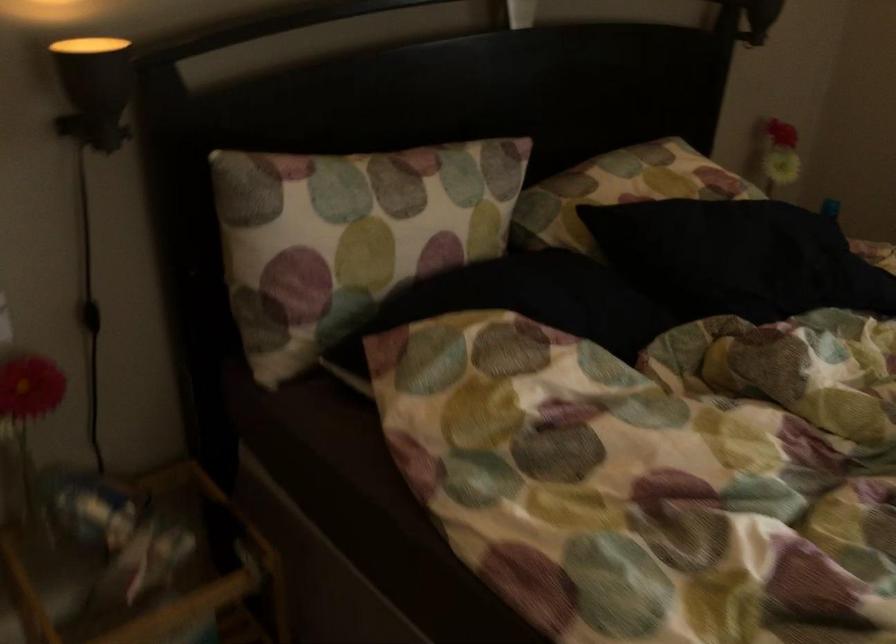
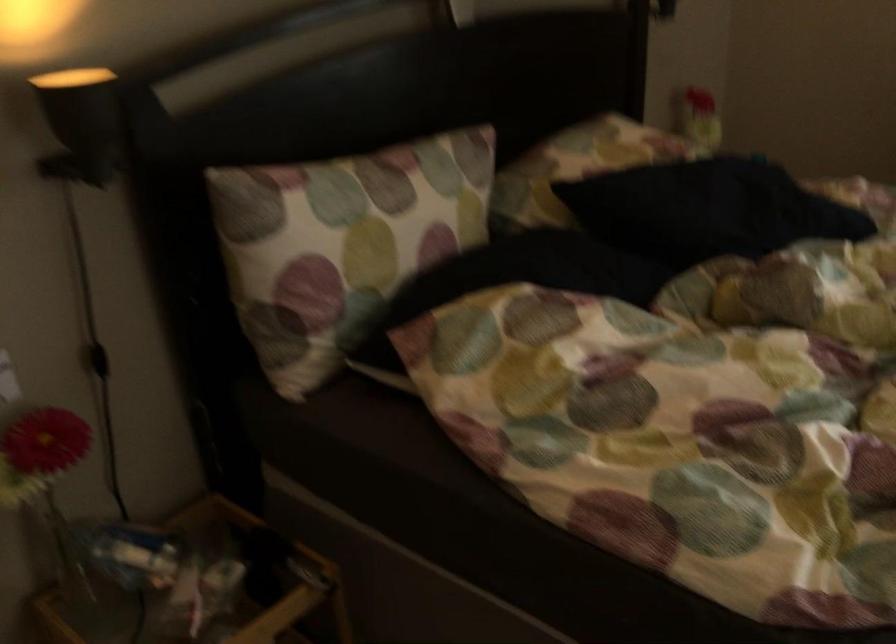
Question: How did the camera likely rotate?

Choices:
 (A) Left
 (B) Right
 (C) Up
 (D) Down

Answer: (B)